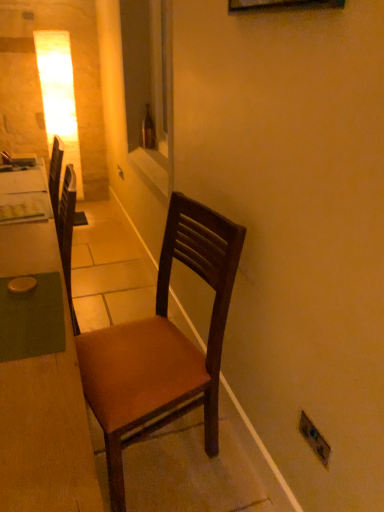
Question: In terms of height, does brown leather chair at center look taller or shorter compared to wooden desk at left?

Choices:
 (A) tall
 (B) short

Answer: (A)

Question: Considering the positions of brown leather chair at center and wooden desk at left in the image, is brown leather chair at center bigger or smaller than wooden desk at left?

Choices:
 (A) big
 (B) small

Answer: (B)

Question: Based on their relative distances, which object is farther from the white glossy window sill at center?

Choices:
 (A) brown glass bottle at center
 (B) matte plastic electric outlet at lower right
 (C) wooden desk at left
 (D) brown leather chair at center

Answer: (B)

Question: Which of these objects is positioned closest to the matte plastic electric outlet at lower right?

Choices:
 (A) wooden desk at left
 (B) brown leather chair at center
 (C) brown glass bottle at center
 (D) white glossy window sill at center

Answer: (B)